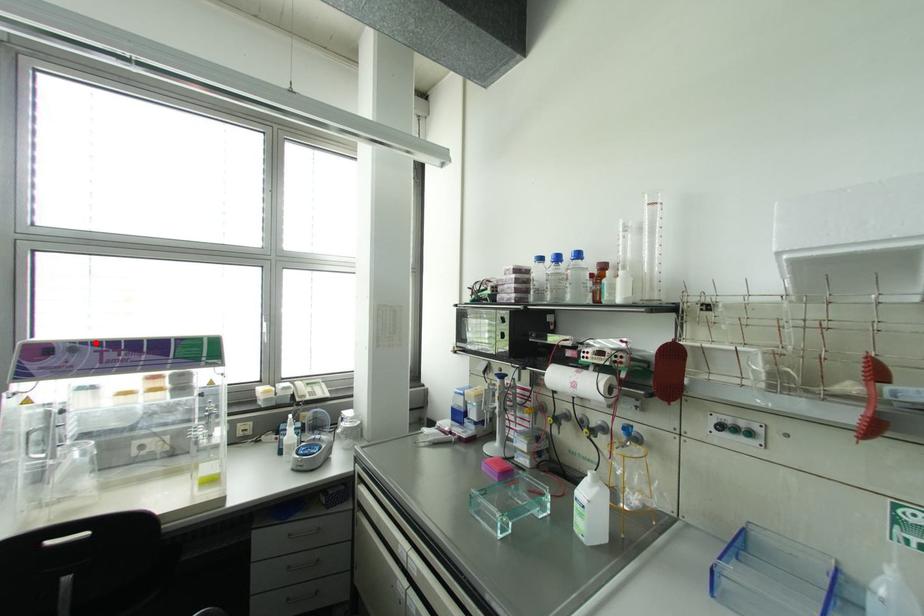
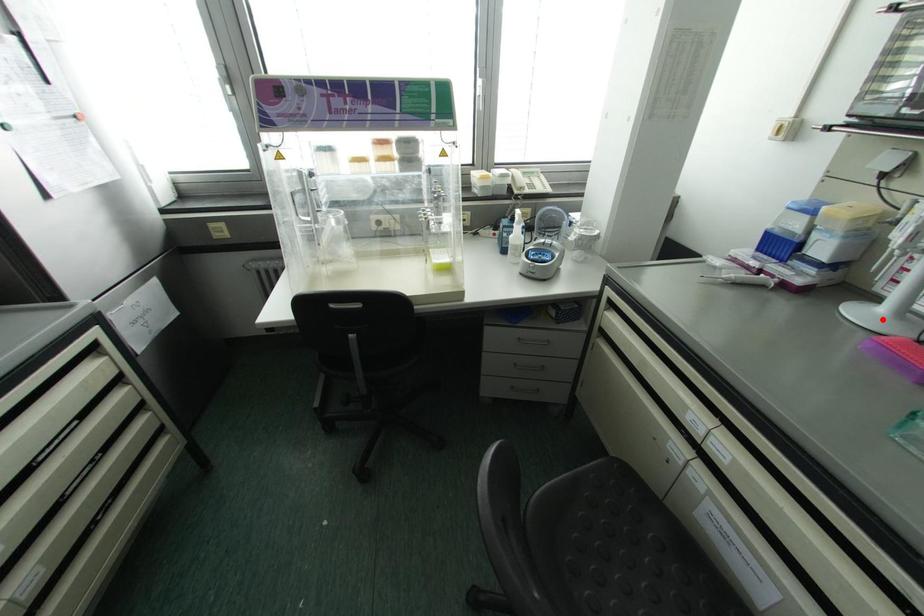
I am providing you with two images of the same scene from different viewpoints. A red point is marked on the first image and another point is marked on the second image. Is the red point in image1 aligned with the point shown in image2?

No